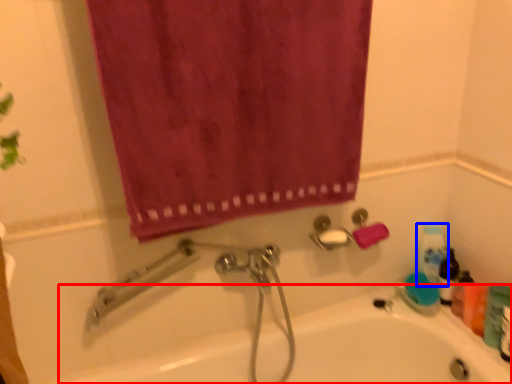
Question: Which point is further to the camera, bath (highlighted by a red box) or cleaning product (highlighted by a blue box)?

Choices:
 (A) bath
 (B) cleaning product

Answer: (B)